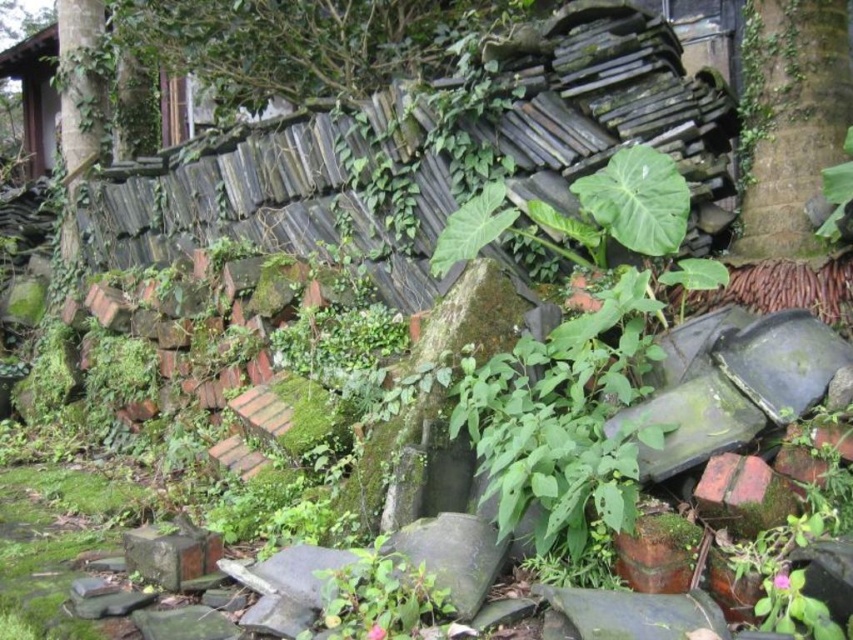
Question: Considering the relative positions of green leafy tree at upper center and green mossy tree trunk at upper right in the image provided, where is green leafy tree at upper center located with respect to green mossy tree trunk at upper right?

Choices:
 (A) left
 (B) right

Answer: (A)

Question: Which point is farther to the camera?

Choices:
 (A) green mossy tree trunk at upper right
 (B) green leafy tree at upper center

Answer: (B)

Question: Is green leafy tree at upper center bigger than green mossy tree trunk at upper right?

Choices:
 (A) yes
 (B) no

Answer: (A)

Question: Where is green leafy tree at upper center located in relation to green mossy tree trunk at upper right in the image?

Choices:
 (A) above
 (B) below

Answer: (A)